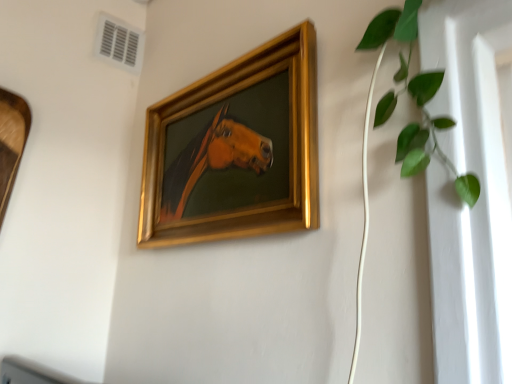
Question: Should I look upward or downward to see white plastic air conditioning at upper left?

Choices:
 (A) up
 (B) down

Answer: (A)

Question: Can you confirm if gold/gilded picture frame at center is positioned to the right of white plastic air conditioning at upper left?

Choices:
 (A) yes
 (B) no

Answer: (A)

Question: Is gold/gilded picture frame at center smaller than white plastic air conditioning at upper left?

Choices:
 (A) no
 (B) yes

Answer: (A)

Question: Considering the relative sizes of gold/gilded picture frame at center and white plastic air conditioning at upper left in the image provided, is gold/gilded picture frame at center wider than white plastic air conditioning at upper left?

Choices:
 (A) no
 (B) yes

Answer: (B)

Question: From a real-world perspective, is gold/gilded picture frame at center physically above white plastic air conditioning at upper left?

Choices:
 (A) no
 (B) yes

Answer: (A)

Question: From the image's perspective, is gold/gilded picture frame at center on white plastic air conditioning at upper left?

Choices:
 (A) yes
 (B) no

Answer: (B)

Question: Does gold/gilded picture frame at center have a larger size compared to white plastic air conditioning at upper left?

Choices:
 (A) no
 (B) yes

Answer: (B)

Question: Is the position of gold/gilded picture frame at center more distant than that of green leafy plant at upper right?

Choices:
 (A) yes
 (B) no

Answer: (A)

Question: Is gold/gilded picture frame at center far away from green leafy plant at upper right?

Choices:
 (A) no
 (B) yes

Answer: (A)

Question: Considering the relative sizes of gold/gilded picture frame at center and green leafy plant at upper right in the image provided, is gold/gilded picture frame at center wider than green leafy plant at upper right?

Choices:
 (A) no
 (B) yes

Answer: (B)

Question: Does gold/gilded picture frame at center lie in front of green leafy plant at upper right?

Choices:
 (A) yes
 (B) no

Answer: (B)

Question: Considering the relative positions of gold/gilded picture frame at center and green leafy plant at upper right in the image provided, is gold/gilded picture frame at center to the right of green leafy plant at upper right from the viewer's perspective?

Choices:
 (A) yes
 (B) no

Answer: (B)

Question: Is gold/gilded picture frame at center not within green leafy plant at upper right?

Choices:
 (A) yes
 (B) no

Answer: (A)

Question: Considering the relative sizes of white plastic air conditioning at upper left and gold/gilded picture frame at center in the image provided, is white plastic air conditioning at upper left smaller than gold/gilded picture frame at center?

Choices:
 (A) no
 (B) yes

Answer: (B)